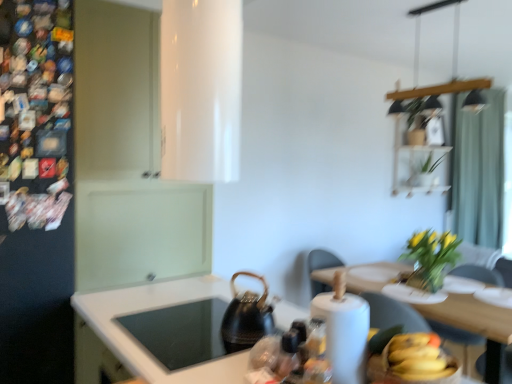
Question: In terms of size, does yellow matte bananas at lower right appear bigger or smaller than yellow-green leaves at upper right, the second plant from the back?

Choices:
 (A) big
 (B) small

Answer: (B)

Question: Is point (424, 340) closer or farther from the camera than point (413, 271)?

Choices:
 (A) farther
 (B) closer

Answer: (B)

Question: Which object is positioned closest to the wooden dining table at lower right?

Choices:
 (A) black textured kettle at center
 (B) black matte refrigerator at left
 (C) yellow matte bananas at lower right
 (D) green matte plant at upper right, the 1th plant from the right
 (E) teal fabric curtain at upper right

Answer: (A)

Question: Which is farther from the yellow-green leaves at upper right, arranged as the second plant when viewed from the right?

Choices:
 (A) white paper towel at lower right
 (B) teal fabric curtain at upper right
 (C) green matte plant at upper right, marked as the second plant in a bottom-to-top arrangement
 (D) white glossy countertop at lower center
 (E) yellow matte bananas at lower right

Answer: (D)